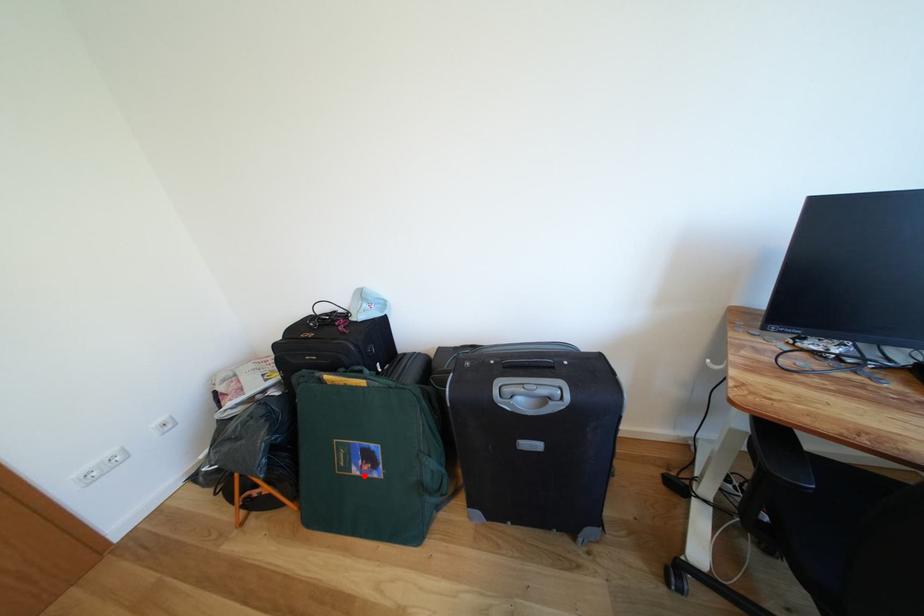
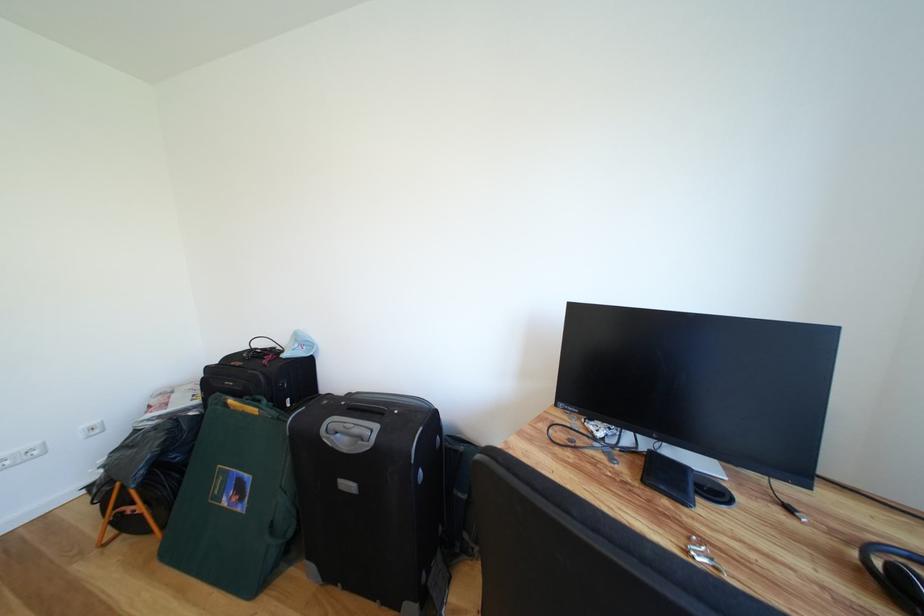
Where in the second image is the point corresponding to the highlighted location from the first image?

(234, 506)